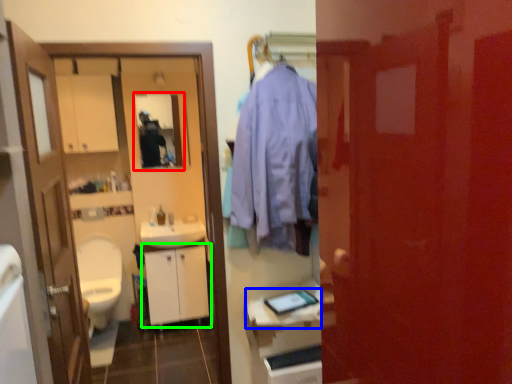
Question: Which object is positioned closest to mirror (highlighted by a red box)? Select from counter top (highlighted by a blue box) and cabinetry (highlighted by a green box).

Choices:
 (A) counter top
 (B) cabinetry

Answer: (B)